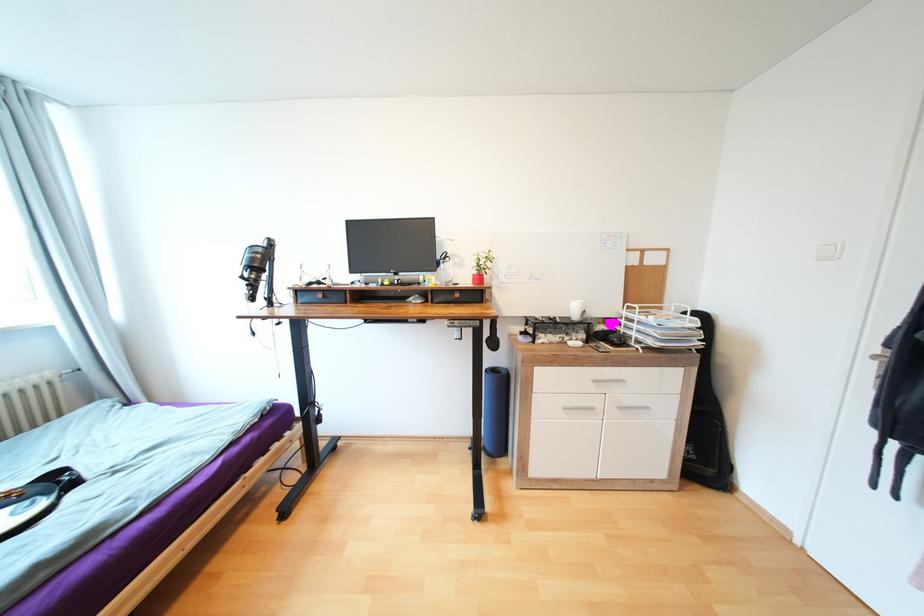
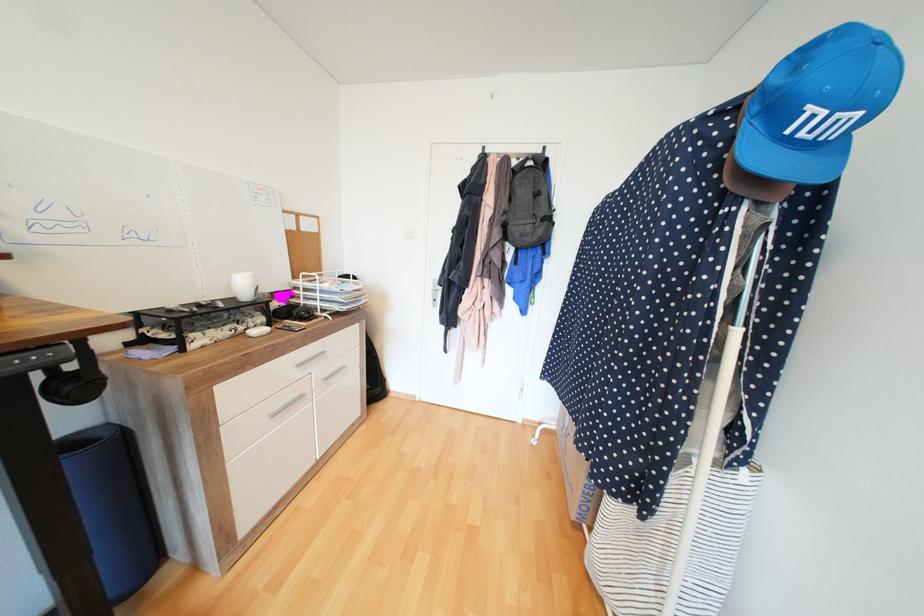
Locate, in the second image, the point that corresponds to point (577, 344) in the first image.

(260, 333)